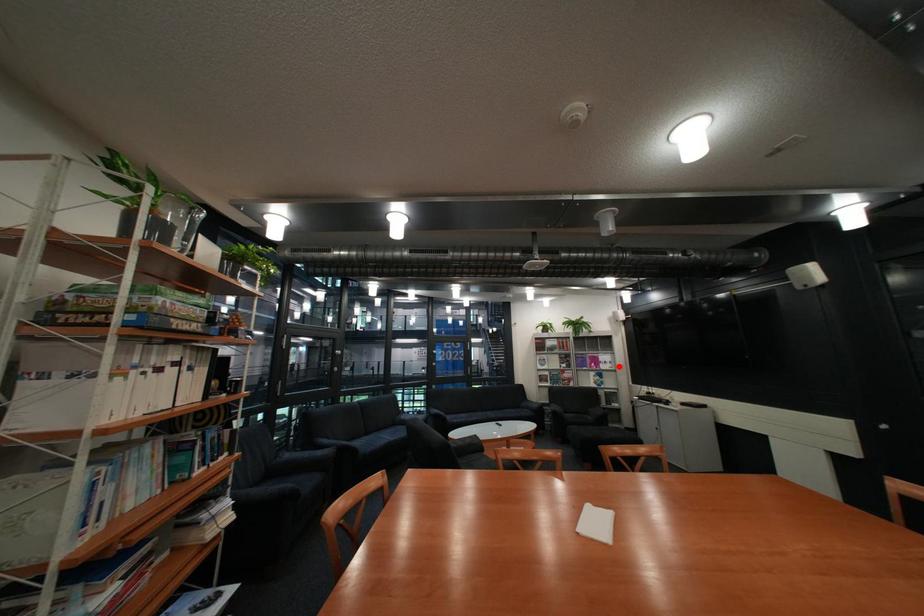
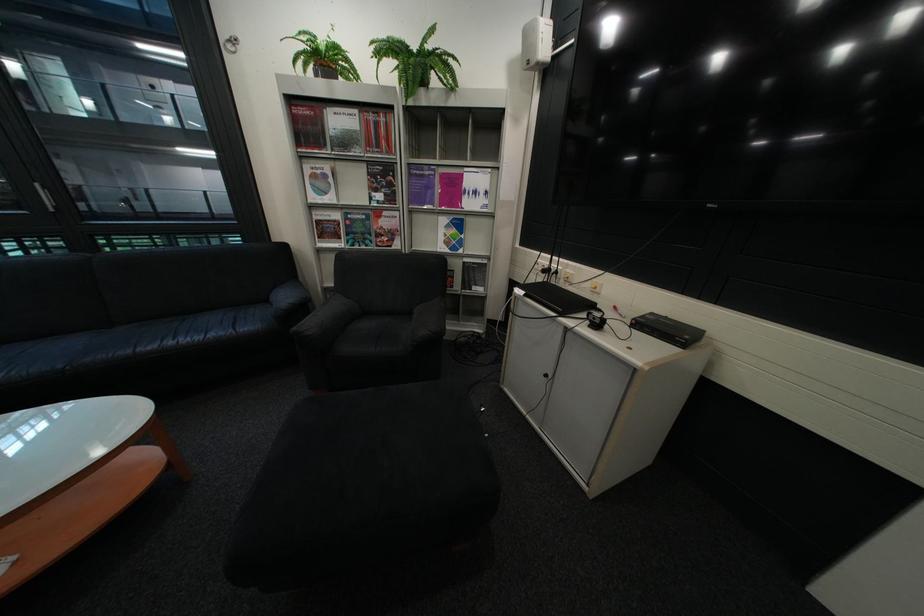
Find the pixel in the second image that matches the highlighted location in the first image.

(484, 204)